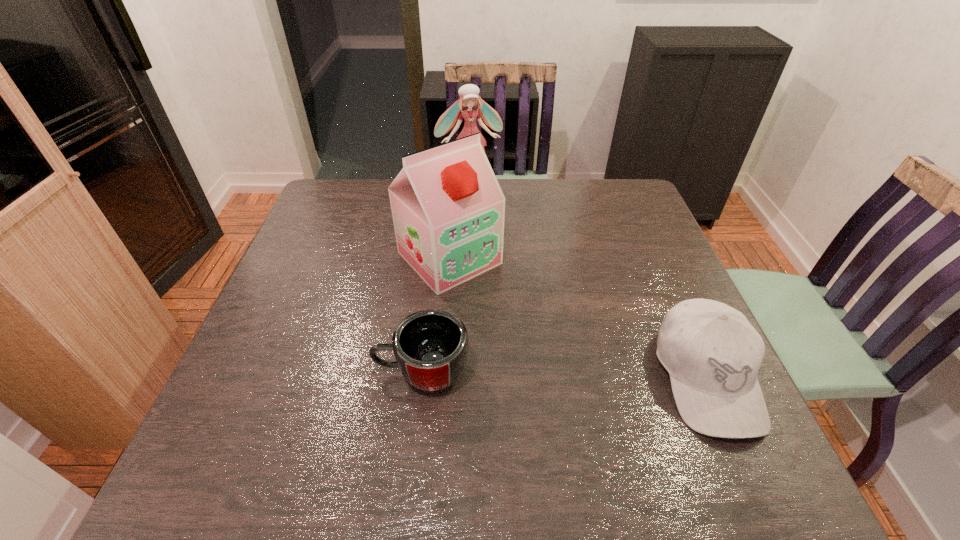
Locate an element on the screen. Image resolution: width=960 pixels, height=540 pixels. vacant space on the desktop that is between the mug and the baseball cap and is positioned with the cap open on the soya milk is located at coordinates (570, 375).

At what (x,y) coordinates should I click in order to perform the action: click on vacant space on the desktop that is between the mug and the third tallest object and is positioned on the front-facing side of the doll. Please return your answer as a coordinate pair (x, y). Looking at the image, I should click on (535, 374).